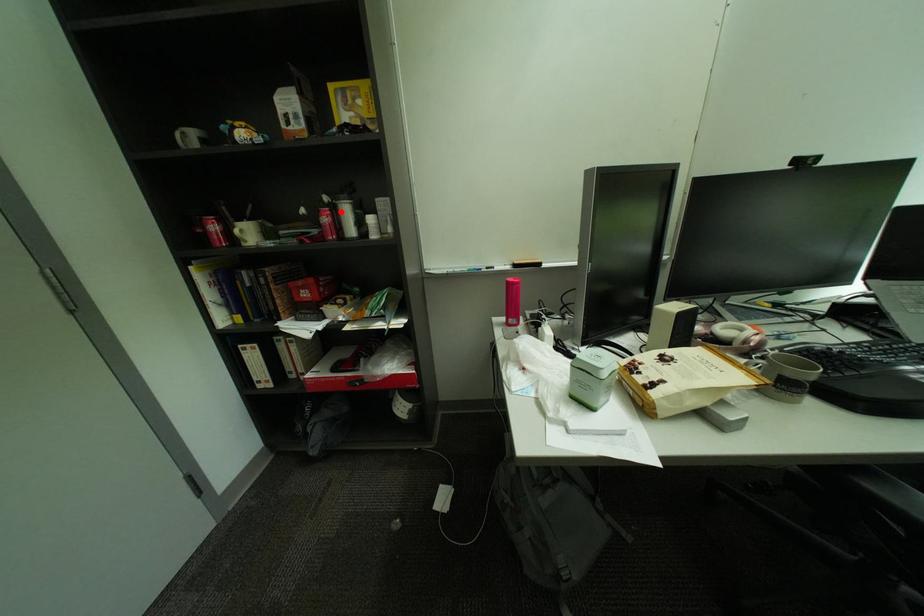
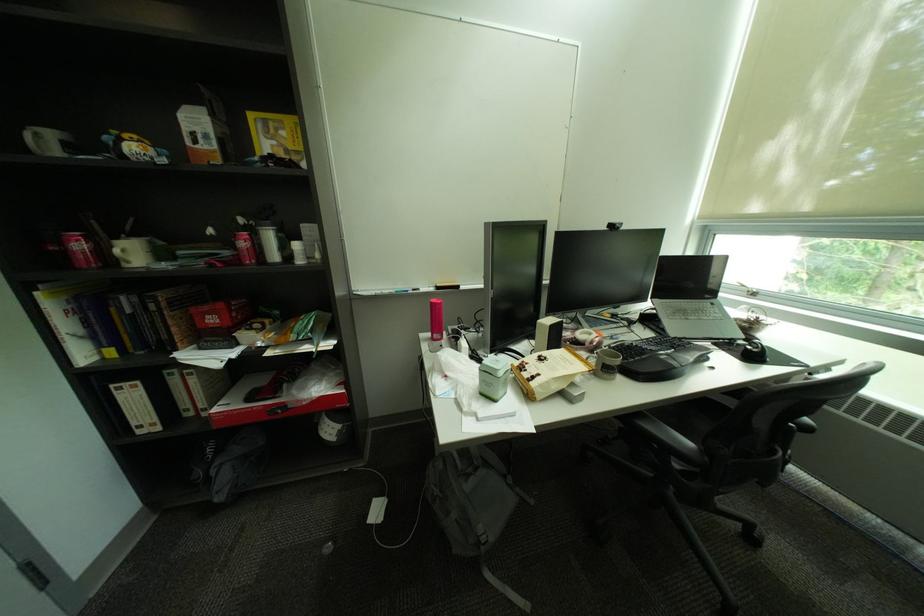
In the second image, find the point that corresponds to the highlighted location in the first image.

(260, 236)